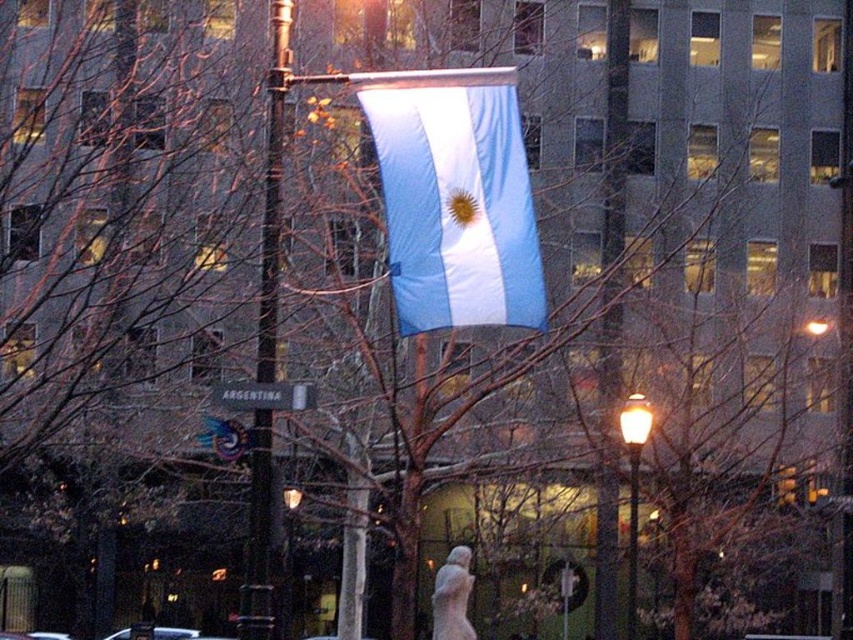
From the picture: Which is below, white plastic street sign at center or matte black lamp post at center?

Positioned lower is matte black lamp post at center.

Who is positioned more to the right, white plastic street sign at center or matte black lamp post at center?

white plastic street sign at center

Who is more distant from viewer, [248,381] or [283,588]?

The point [283,588] is behind.

This screenshot has height=640, width=853. In order to click on white plastic street sign at center in this screenshot , I will do `click(263, 396)`.

Is metallic pole at center below matte black lamp post at right?

Incorrect, metallic pole at center is not positioned below matte black lamp post at right.

Does metallic pole at center have a smaller size compared to matte black lamp post at right?

Yes, metallic pole at center is smaller than matte black lamp post at right.

You are a GUI agent. You are given a task and a screenshot of the screen. Output one action in this format:
    pyautogui.click(x=<x>, y=<y>)
    Task: Click on the metallic pole at center
    This screenshot has height=640, width=853.
    Given the screenshot: What is the action you would take?
    tap(273, 189)

Between metallic pole at center and matte black lamp post at center, which one is positioned higher?

metallic pole at center

Is point (271, 68) farther from viewer compared to point (293, 522)?

No, (271, 68) is closer to viewer.

What do you see at coordinates (273, 189) in the screenshot? I see `metallic pole at center` at bounding box center [273, 189].

This screenshot has height=640, width=853. What are the coordinates of `metallic pole at center` in the screenshot? It's located at click(273, 189).